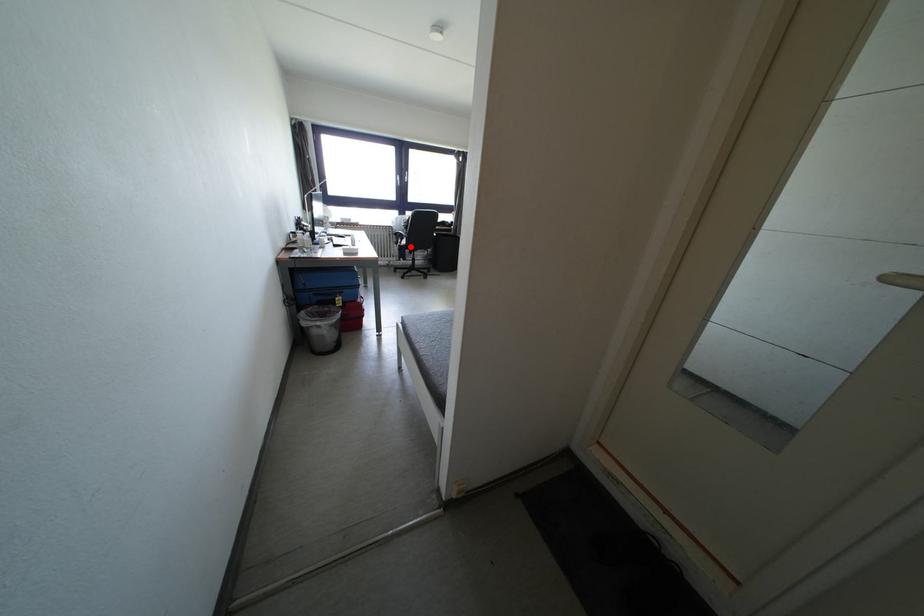
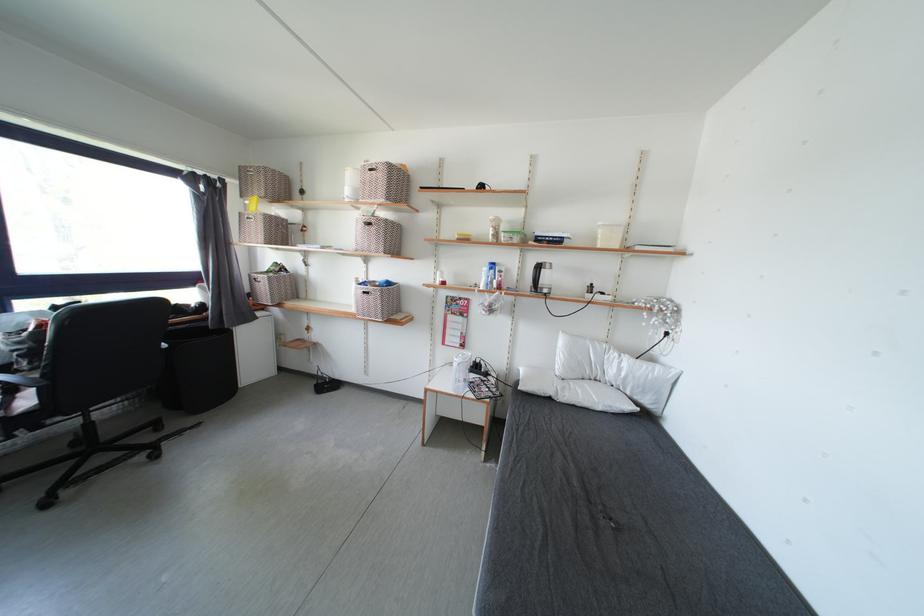
Question: I am providing you with two images of the same scene from different viewpoints. In image1, a red point is highlighted. Considering the same 3D point in image2, which of the following is correct?

Choices:
 (A) It is closer
 (B) It is farther

Answer: (B)